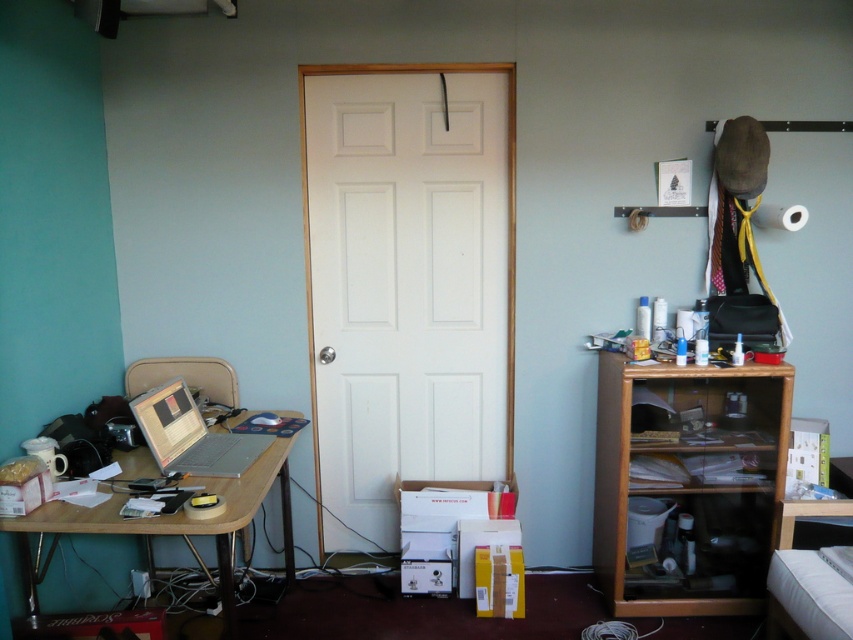
Which of these two, wooden desk at left or silver metallic laptop at left, stands shorter?

→ Standing shorter between the two is silver metallic laptop at left.

Which is above, wooden desk at left or silver metallic laptop at left?

silver metallic laptop at left

Is point (56, 509) farther from camera compared to point (213, 476)?

No, it is in front of (213, 476).

You are a GUI agent. You are given a task and a screenshot of the screen. Output one action in this format:
    pyautogui.click(x=<x>, y=<y>)
    Task: Click on the wooden desk at left
    The width and height of the screenshot is (853, 640).
    Given the screenshot: What is the action you would take?
    coord(171,524)

Measure the distance between wooden cabinet at right and camera.

wooden cabinet at right and camera are 2.58 meters apart.

Does wooden cabinet at right appear on the right side of wooden desk at left?

Yes, wooden cabinet at right is to the right of wooden desk at left.

Locate an element on the screen. This screenshot has width=853, height=640. wooden cabinet at right is located at coordinates point(688,483).

Is wooden cabinet at right above silver metallic laptop at left?

Actually, wooden cabinet at right is below silver metallic laptop at left.

Which is behind, point (727, 560) or point (216, 476)?

Positioned behind is point (727, 560).

Does point (664, 452) come in front of point (201, 433)?

No.

This screenshot has height=640, width=853. Find the location of `wooden cabinet at right`. wooden cabinet at right is located at coordinates (688, 483).